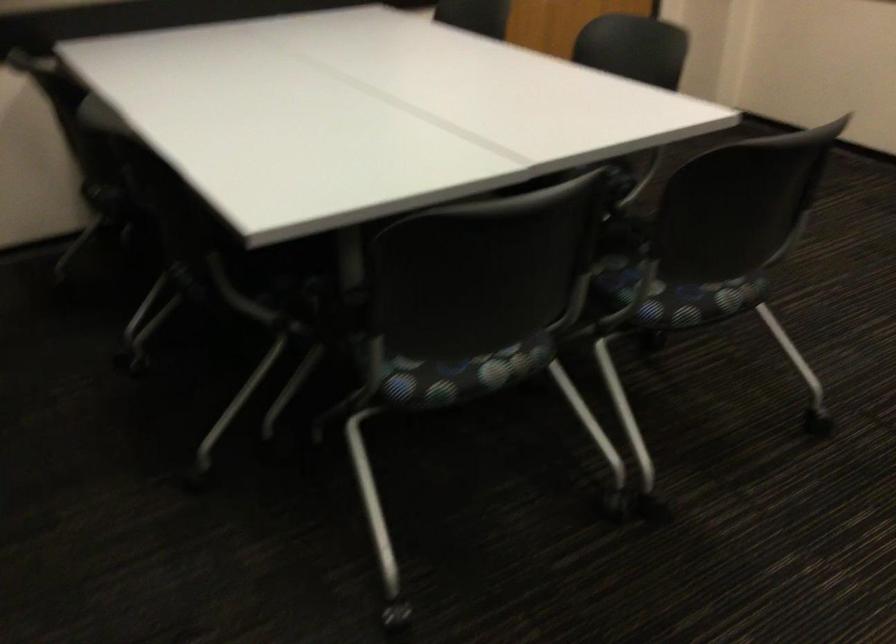
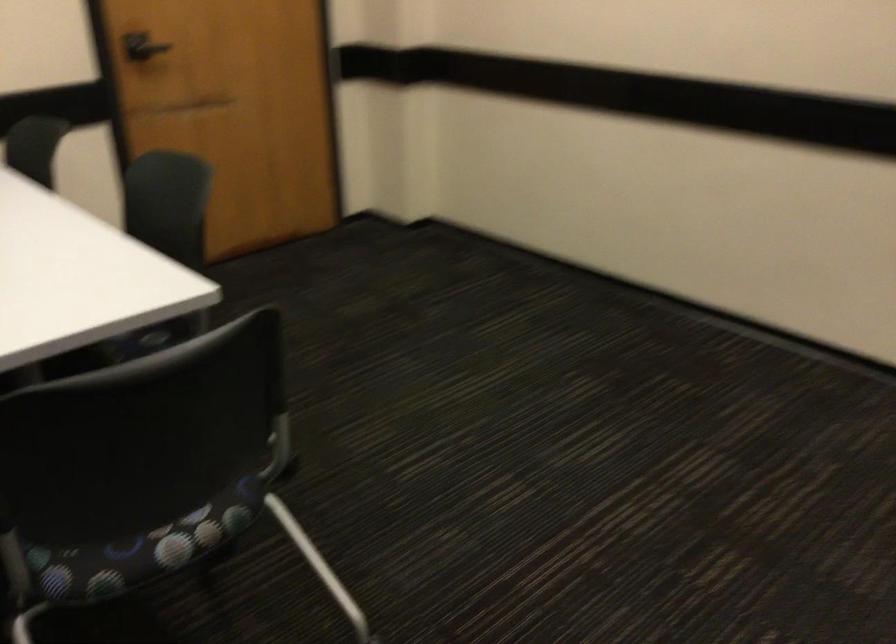
In a continuous first-person perspective shot, in which direction is the camera moving?

The movement direction of the cameraman is right, forward.